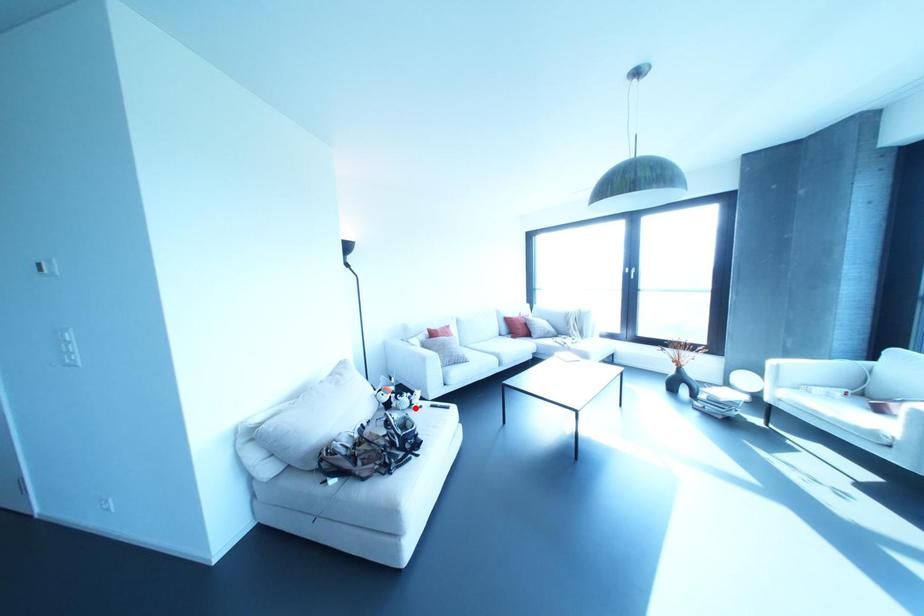
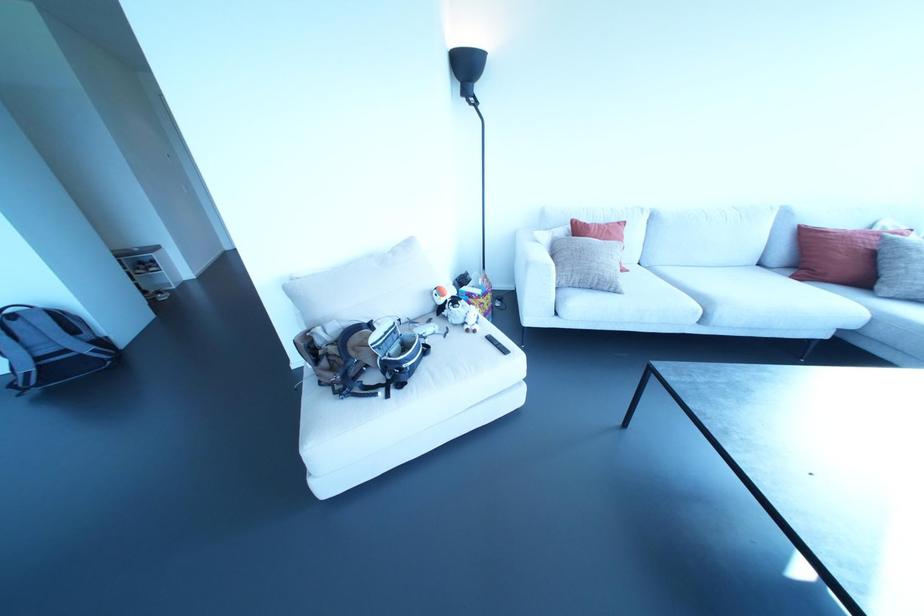
In the second image, find the point that corresponds to the highlighted location in the first image.

(467, 330)